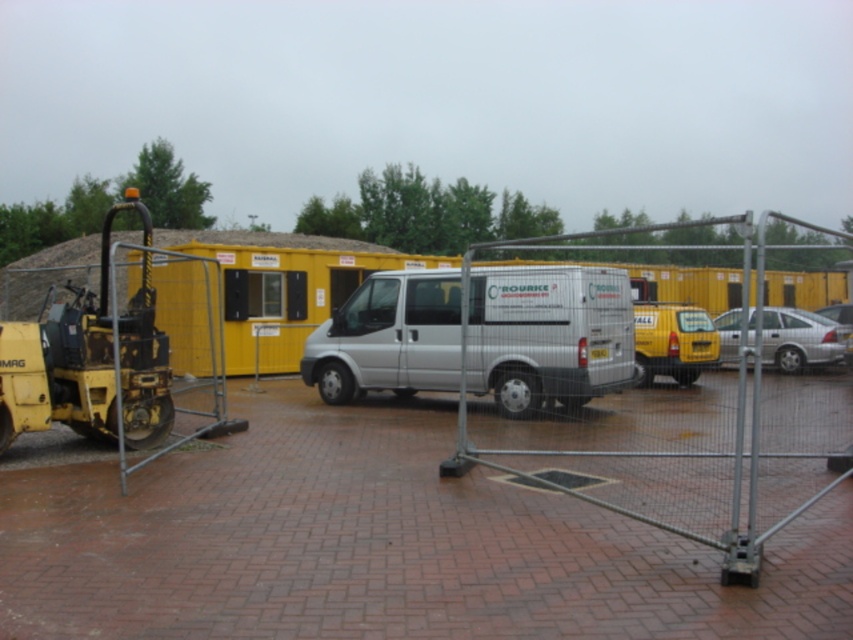
You are driving a delivery truck that is 2 meters wide. You need to pass through the gap between the yellow metal container at center and the silver metallic sedan at center. Can your truck fit through the gap?

The yellow metal container at center is wider than the silver metallic sedan at center. However, the exact width of the gap isn t specified in the provided information. Therefore, it s uncertain whether the truck can fit through the gap. Further measurements are needed.

Based on the photo, you are a delivery driver who needs to park your truck between the yellow matte van at center and the silver metallic sedan at center. Given that your truck is 6 meters long, can you fit it in the space between them?

The yellow matte van at center is smaller than the silver metallic sedan at center, but the distance between them isn not provided in the objects description. Therefore, it is impossible to determine if the truck will fit.

You are a delivery driver who needs to park your truck in a spot that can accommodate vehicles up to 2 meters in height. You see the silver metallic van at center and the silver metallic sedan at center. Which vehicle requires a taller parking space?

The silver metallic van at center requires a taller parking space because it is taller than the silver metallic sedan at center.